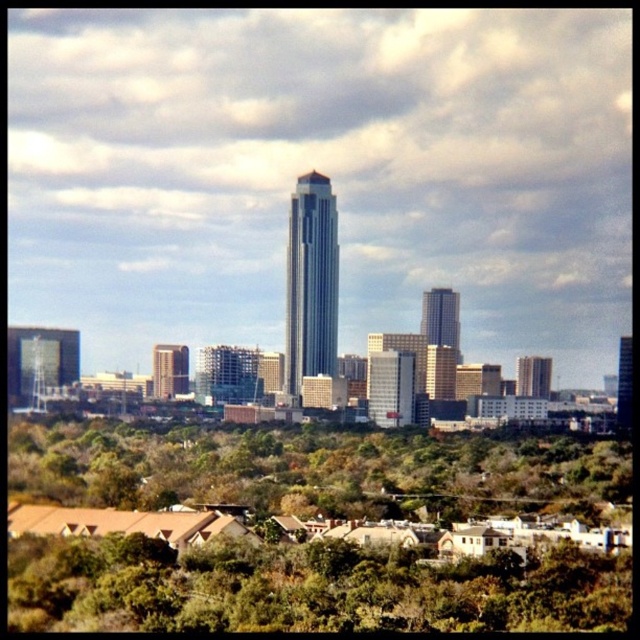
Who is positioned more to the left, matte gray building at right or matte glass skyscraper at center?

From the viewer's perspective, matte gray building at right appears more on the left side.

Where is `matte gray building at right`? The width and height of the screenshot is (640, 640). matte gray building at right is located at coordinates (532, 376).

Identify the location of matte gray building at right. (532, 376).

You are a GUI agent. You are given a task and a screenshot of the screen. Output one action in this format:
    pyautogui.click(x=<x>, y=<y>)
    Task: Click on the matte gray building at right
    The width and height of the screenshot is (640, 640).
    Given the screenshot: What is the action you would take?
    pyautogui.click(x=532, y=376)

Does green leafy tree at lower center lie behind matte glass skyscraper at center?

That is False.

Locate an element on the screen. The width and height of the screenshot is (640, 640). green leafy tree at lower center is located at coordinates (307, 588).

Which is more to the left, silver glass skyscraper at center or sleek glass skyscraper at center?

silver glass skyscraper at center is more to the left.

Is silver glass skyscraper at center positioned behind sleek glass skyscraper at center?

No, it is not.

Find the location of `silver glass skyscraper at center`. silver glass skyscraper at center is located at coordinates (310, 282).